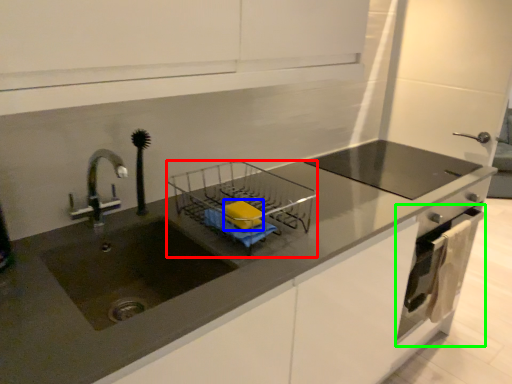
Question: Which is nearer to the appliance (highlighted by a red box)? soap (highlighted by a blue box) or oven (highlighted by a green box).

Choices:
 (A) soap
 (B) oven

Answer: (A)